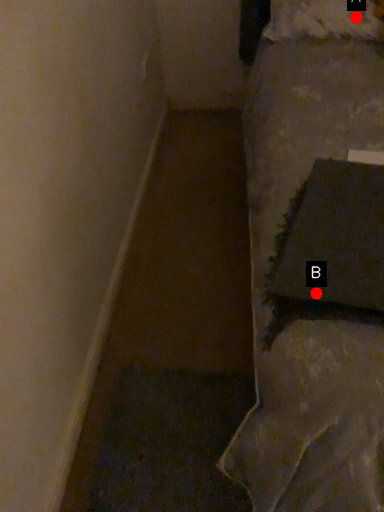
Question: Two points are circled on the image, labeled by A and B beside each circle. Among these points, which one is farthest from the camera?

Choices:
 (A) A is further
 (B) B is further

Answer: (A)